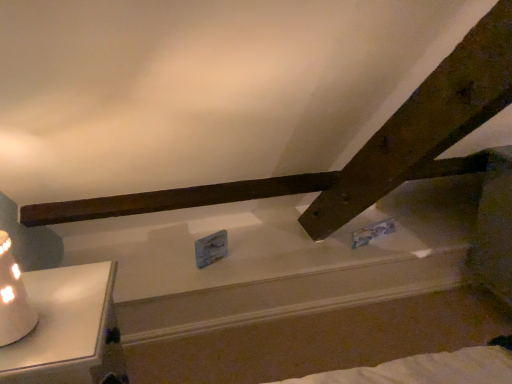
Image resolution: width=512 pixels, height=384 pixels. I want to click on vacant area that is situated to the right of white ceramic table lamp at lower left, so click(67, 334).